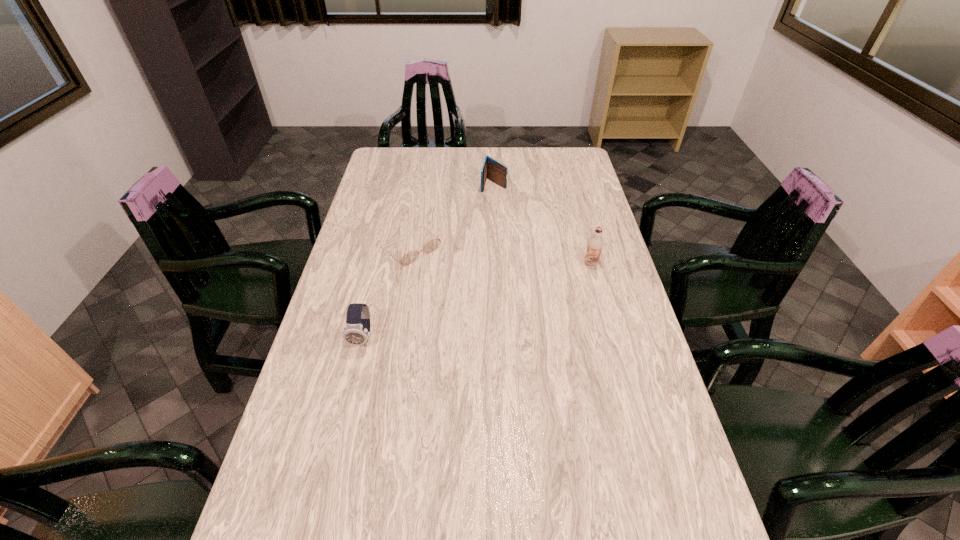
Locate an element on the screen. This screenshot has height=540, width=960. vacant space on the desktop that is between the nearest object and the chocolate milk and is positioned on the exterior surface of the wallet is located at coordinates (461, 306).

Locate an element on the screen. This screenshot has height=540, width=960. vacant space on the desktop that is between the watch and the rightmost object and is positioned on the face of the sunglasses is located at coordinates click(x=475, y=301).